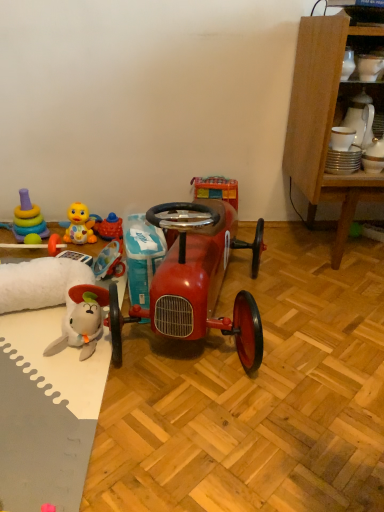
Question: Can you confirm if rubber duck at left, which is the 4th toy from left to right, is bigger than yellow rubber duck at left, which is counted as the third toy, starting from the right?

Choices:
 (A) no
 (B) yes

Answer: (A)

Question: Can you confirm if rubber duck at left, acting as the 2th toy starting from the right, is positioned to the left of yellow rubber duck at left, which is the 3th toy from left to right?

Choices:
 (A) yes
 (B) no

Answer: (B)

Question: Is rubber duck at left, which is the 4th toy from left to right, looking in the opposite direction of yellow rubber duck at left, which is the 3th toy from left to right?

Choices:
 (A) no
 (B) yes

Answer: (A)

Question: From a real-world perspective, is rubber duck at left, acting as the 2th toy starting from the right, positioned over yellow rubber duck at left, which is counted as the third toy, starting from the right, based on gravity?

Choices:
 (A) yes
 (B) no

Answer: (B)

Question: Can you confirm if rubber duck at left, acting as the 2th toy starting from the right, is positioned to the right of yellow rubber duck at left, which is counted as the third toy, starting from the right?

Choices:
 (A) yes
 (B) no

Answer: (A)

Question: Is rubber duck at left, acting as the 2th toy starting from the right, taller than yellow rubber duck at left, which is the 3th toy from left to right?

Choices:
 (A) yes
 (B) no

Answer: (B)

Question: From a real-world perspective, is white glossy mug at upper center, which is counted as the 5th toy, starting from the left, positioned over yellow rubber duck at left, which is counted as the third toy, starting from the right, based on gravity?

Choices:
 (A) no
 (B) yes

Answer: (B)

Question: Is white glossy mug at upper center, which is counted as the 1th toy, starting from the right, wider than yellow rubber duck at left, which is the 3th toy from left to right?

Choices:
 (A) no
 (B) yes

Answer: (B)

Question: Is white glossy mug at upper center, which is counted as the 1th toy, starting from the right, to the right of yellow rubber duck at left, which is the 3th toy from left to right, from the viewer's perspective?

Choices:
 (A) yes
 (B) no

Answer: (A)

Question: Could yellow rubber duck at left, which is the 3th toy from left to right, be considered to be inside white glossy mug at upper center, which is counted as the 1th toy, starting from the right?

Choices:
 (A) yes
 (B) no

Answer: (B)

Question: From the image's perspective, does white glossy mug at upper center, which is counted as the 1th toy, starting from the right, appear lower than yellow rubber duck at left, which is counted as the third toy, starting from the right?

Choices:
 (A) yes
 (B) no

Answer: (B)

Question: Does white glossy mug at upper center, which is counted as the 1th toy, starting from the right, come behind yellow rubber duck at left, which is the 3th toy from left to right?

Choices:
 (A) yes
 (B) no

Answer: (B)

Question: From a real-world perspective, is wooden cabinet at right physically below rubber duck at lower left, the second toy in the left-to-right sequence?

Choices:
 (A) yes
 (B) no

Answer: (B)